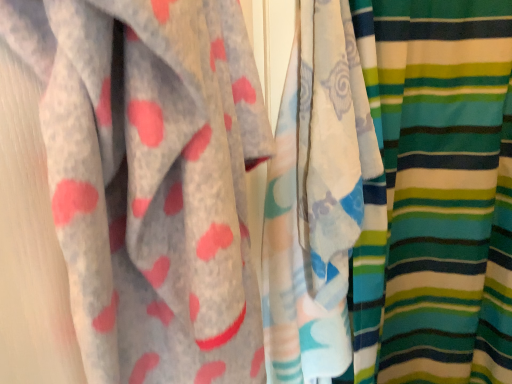
Question: Is white cotton towel at center, positioned as the first curtain in left-to-right order, taller or shorter than striped fabric at right, which ranks as the 1th curtain in right-to-left order?

Choices:
 (A) tall
 (B) short

Answer: (B)

Question: Is white cotton towel at center, acting as the second curtain starting from the right, spatially inside striped fabric at right, which ranks as the 1th curtain in right-to-left order, or outside of it?

Choices:
 (A) inside
 (B) outside

Answer: (A)

Question: Relative to striped fabric at right, marked as the second curtain in a left-to-right arrangement, is white cotton towel at center, acting as the second curtain starting from the right, in front or behind?

Choices:
 (A) behind
 (B) front

Answer: (B)

Question: In the image, is striped fabric at right, which ranks as the 1th curtain in right-to-left order, positioned in front of or behind white cotton towel at center, positioned as the first curtain in left-to-right order?

Choices:
 (A) front
 (B) behind

Answer: (B)

Question: From their relative heights in the image, would you say striped fabric at right, which ranks as the 1th curtain in right-to-left order, is taller or shorter than white cotton towel at center, positioned as the first curtain in left-to-right order?

Choices:
 (A) short
 (B) tall

Answer: (B)

Question: Is striped fabric at right, marked as the second curtain in a left-to-right arrangement, inside the boundaries of white cotton towel at center, acting as the second curtain starting from the right, or outside?

Choices:
 (A) inside
 (B) outside

Answer: (B)

Question: Considering the positions of point (402, 144) and point (329, 200), is point (402, 144) closer or farther from the camera than point (329, 200)?

Choices:
 (A) farther
 (B) closer

Answer: (A)